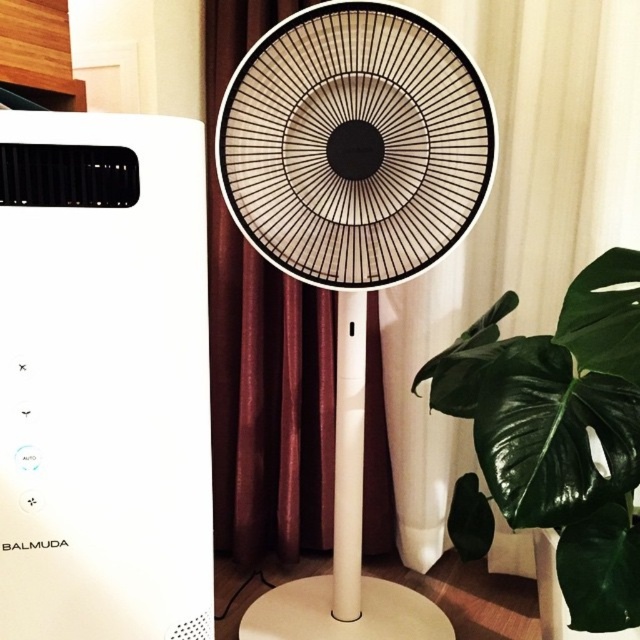
Does point (304, 244) come behind point (609, 436)?

Yes, it is behind point (609, 436).

Can you confirm if black matte fan at center is thinner than green matte leaf at lower right?

No, black matte fan at center is not thinner than green matte leaf at lower right.

Between point (429, 214) and point (493, 368), which one is positioned in front?

Point (493, 368) is more forward.

Locate an element on the screen. black matte fan at center is located at coordinates (353, 234).